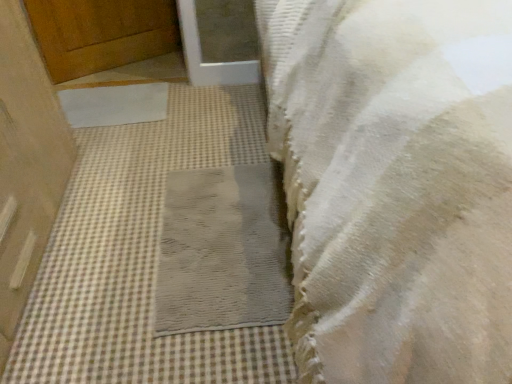
You are a GUI agent. You are given a task and a screenshot of the screen. Output one action in this format:
    pyautogui.click(x=<x>, y=<y>)
    Task: Click on the vacant area that lies between white matte mat at center, the second mat in the right-to-left sequence, and gray textured mat at center, the 2th mat in the back-to-front sequence
    The image size is (512, 384).
    Given the screenshot: What is the action you would take?
    (150, 167)